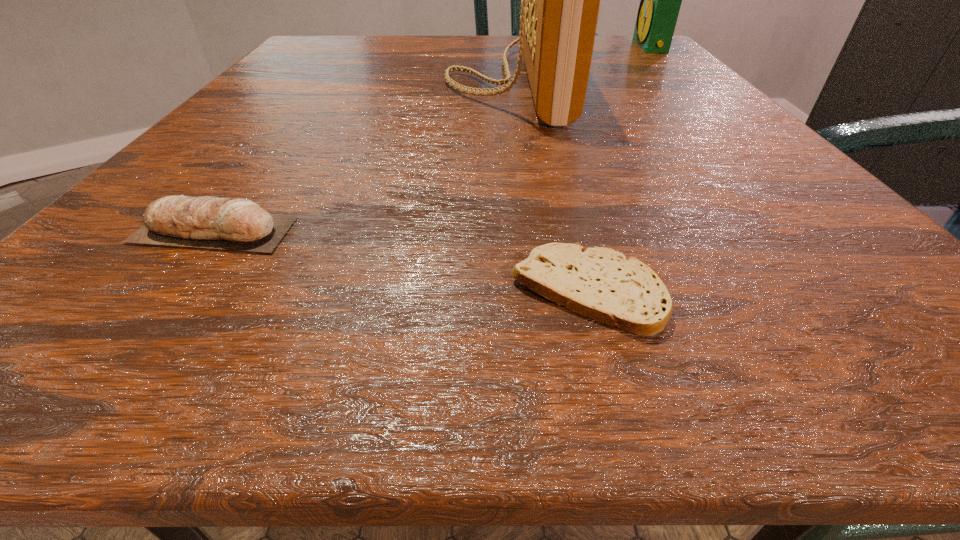
Identify the location of blank area in the image that satisfies the following two spatial constraints: 1. on the back side of the right pita bread; 2. on the decorative side of the tallest object. (532, 81).

Identify the location of vacant space that satisfies the following two spatial constraints: 1. on the front-facing side of the alarm clock; 2. on the front side of the shortest object. Image resolution: width=960 pixels, height=540 pixels. (897, 291).

The width and height of the screenshot is (960, 540). In order to click on vacant region that satisfies the following two spatial constraints: 1. on the decorative side of the handbag; 2. on the back side of the shorter pita bread in this screenshot , I will do tap(547, 291).